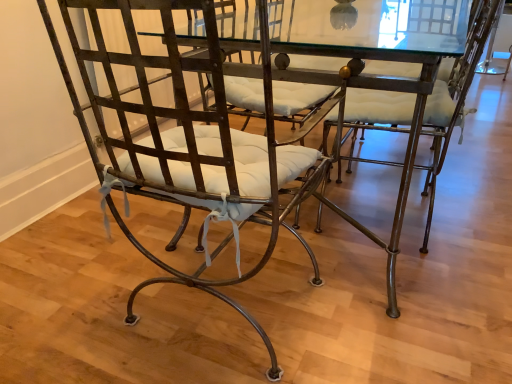
In the scene shown: Measure the distance between point (425, 185) and camera.

The distance of point (425, 185) from camera is 1.95 meters.

At what (x,y) coordinates should I click in order to perform the action: click on glass transparent table at center. Please return your answer as a coordinate pair (x, y). Image resolution: width=512 pixels, height=384 pixels. Looking at the image, I should click on (386, 90).

At what (x,y) coordinates should I click in order to perform the action: click on matte metal chair at center, which ranks as the second chair in right-to-left order. Please return your answer as a coordinate pair (x, y). Looking at the image, I should click on (190, 140).

Image resolution: width=512 pixels, height=384 pixels. I want to click on matte metal chair at center, the second chair viewed from the left, so pyautogui.click(x=453, y=100).

Is matte metal chair at center, placed as the first chair when sorted from right to left, bigger or smaller than matte metal chair at center, which appears as the 1th chair when viewed from the left?

matte metal chair at center, placed as the first chair when sorted from right to left, is smaller than matte metal chair at center, which appears as the 1th chair when viewed from the left.

From the image's perspective, is matte metal chair at center, placed as the first chair when sorted from right to left, located above matte metal chair at center, which appears as the 1th chair when viewed from the left?

Correct, matte metal chair at center, placed as the first chair when sorted from right to left, appears higher than matte metal chair at center, which appears as the 1th chair when viewed from the left, in the image.

Between point (490, 10) and point (179, 172), which one is positioned behind?

The point (490, 10) is farther from the camera.

From a real-world perspective, is matte metal chair at center, the second chair viewed from the left, physically located above or below matte metal chair at center, which ranks as the second chair in right-to-left order?

Clearly, from a real-world perspective, matte metal chair at center, the second chair viewed from the left, is below matte metal chair at center, which ranks as the second chair in right-to-left order.

Is matte metal chair at center, placed as the first chair when sorted from right to left, positioned with its back to glass transparent table at center?

Yes, glass transparent table at center is at the back of matte metal chair at center, placed as the first chair when sorted from right to left.

Are matte metal chair at center, the second chair viewed from the left, and glass transparent table at center beside each other?

No.

Is point (448, 140) closer to viewer compared to point (404, 56)?

That is False.

From a real-world perspective, which is physically below, matte metal chair at center, the second chair viewed from the left, or glass transparent table at center?

glass transparent table at center is physically lower.

Would you say glass transparent table at center contains matte metal chair at center, placed as the first chair when sorted from right to left?

Absolutely, matte metal chair at center, placed as the first chair when sorted from right to left, is inside glass transparent table at center.

Could you measure the distance between glass transparent table at center and matte metal chair at center, the second chair viewed from the left?

13.57 inches.

Does glass transparent table at center appear on the left side of matte metal chair at center, the second chair viewed from the left?

Indeed, glass transparent table at center is positioned on the left side of matte metal chair at center, the second chair viewed from the left.

Considering the relative sizes of glass transparent table at center and matte metal chair at center, placed as the first chair when sorted from right to left, in the image provided, is glass transparent table at center bigger than matte metal chair at center, placed as the first chair when sorted from right to left,?

Yes.

Considering the sizes of objects glass transparent table at center and matte metal chair at center, which appears as the 1th chair when viewed from the left, in the image provided, who is smaller, glass transparent table at center or matte metal chair at center, which appears as the 1th chair when viewed from the left,?

matte metal chair at center, which appears as the 1th chair when viewed from the left, is smaller.

Can you confirm if glass transparent table at center is positioned to the left of matte metal chair at center, which appears as the 1th chair when viewed from the left?

Incorrect, glass transparent table at center is not on the left side of matte metal chair at center, which appears as the 1th chair when viewed from the left.

From the image's perspective, relative to matte metal chair at center, which appears as the 1th chair when viewed from the left, is glass transparent table at center above or below?

glass transparent table at center is above matte metal chair at center, which appears as the 1th chair when viewed from the left.

Are glass transparent table at center and matte metal chair at center, which ranks as the second chair in right-to-left order, far apart?

No, glass transparent table at center is not far from matte metal chair at center, which ranks as the second chair in right-to-left order.

Which point is more forward, (165, 8) or (462, 123)?

Point (165, 8)

Looking at the image, does matte metal chair at center, which appears as the 1th chair when viewed from the left, seem bigger or smaller compared to matte metal chair at center, the second chair viewed from the left?

In the image, matte metal chair at center, which appears as the 1th chair when viewed from the left, appears to be larger than matte metal chair at center, the second chair viewed from the left.

Is the depth of matte metal chair at center, which appears as the 1th chair when viewed from the left, less than that of matte metal chair at center, placed as the first chair when sorted from right to left?

Yes, matte metal chair at center, which appears as the 1th chair when viewed from the left, is closer to the camera.

In terms of width, does matte metal chair at center, which appears as the 1th chair when viewed from the left, look wider or thinner when compared to matte metal chair at center, placed as the first chair when sorted from right to left?

matte metal chair at center, which appears as the 1th chair when viewed from the left, is wider than matte metal chair at center, placed as the first chair when sorted from right to left.

From the image's perspective, between matte metal chair at center, which appears as the 1th chair when viewed from the left, and glass transparent table at center, which one is located above?

glass transparent table at center appears higher in the image.

Which object is positioned more to the right, matte metal chair at center, which appears as the 1th chair when viewed from the left, or glass transparent table at center?

glass transparent table at center.

Considering the points (209, 13) and (449, 11), which point is behind, point (209, 13) or point (449, 11)?

Point (449, 11)

Locate an element on the screen. This screenshot has height=384, width=512. chair that is on the left side of matte metal chair at center, the second chair viewed from the left is located at coordinates (190, 140).

Identify the location of round table that appears in front of the matte metal chair at center, placed as the first chair when sorted from right to left. The height and width of the screenshot is (384, 512). (386, 90).

Based on their spatial positions, is matte metal chair at center, placed as the first chair when sorted from right to left, or matte metal chair at center, which ranks as the second chair in right-to-left order, further from glass transparent table at center?

matte metal chair at center, placed as the first chair when sorted from right to left, lies further to glass transparent table at center than the other object.

Considering their positions, is matte metal chair at center, which ranks as the second chair in right-to-left order, positioned further to matte metal chair at center, placed as the first chair when sorted from right to left, than glass transparent table at center?

matte metal chair at center, which ranks as the second chair in right-to-left order, lies further to matte metal chair at center, placed as the first chair when sorted from right to left, than the other object.

Looking at this image, which object lies nearer to the anchor point matte metal chair at center, which appears as the 1th chair when viewed from the left, glass transparent table at center or matte metal chair at center, placed as the first chair when sorted from right to left?

glass transparent table at center lies closer to matte metal chair at center, which appears as the 1th chair when viewed from the left, than the other object.

Looking at the image, which one is located closer to glass transparent table at center, matte metal chair at center, which ranks as the second chair in right-to-left order, or matte metal chair at center, placed as the first chair when sorted from right to left?

matte metal chair at center, which ranks as the second chair in right-to-left order, lies closer to glass transparent table at center than the other object.

Which object lies further to the anchor point matte metal chair at center, which ranks as the second chair in right-to-left order, matte metal chair at center, placed as the first chair when sorted from right to left, or glass transparent table at center?

The object further to matte metal chair at center, which ranks as the second chair in right-to-left order, is matte metal chair at center, placed as the first chair when sorted from right to left.

Looking at the image, which one is located closer to matte metal chair at center, the second chair viewed from the left, glass transparent table at center or matte metal chair at center, which appears as the 1th chair when viewed from the left?

glass transparent table at center is closer to matte metal chair at center, the second chair viewed from the left.

The width and height of the screenshot is (512, 384). What are the coordinates of `round table between matte metal chair at center, which appears as the 1th chair when viewed from the left, and matte metal chair at center, placed as the first chair when sorted from right to left, from left to right` in the screenshot? It's located at (386, 90).